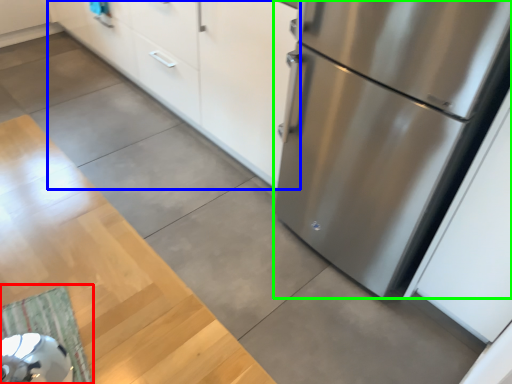
Question: Which is farther away from doormat (highlighted by a red box)? cabinetry (highlighted by a blue box) or refrigerator (highlighted by a green box)?

Choices:
 (A) cabinetry
 (B) refrigerator

Answer: (A)